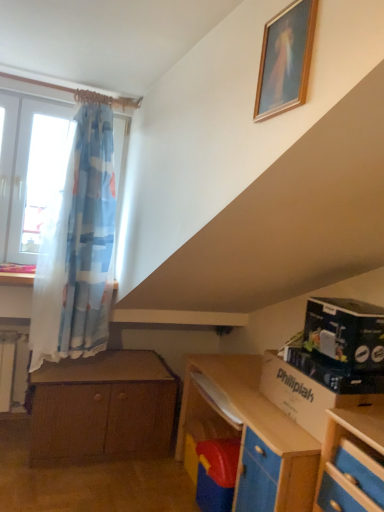
Question: Does brown wooden chest of drawers at lower left appear on the left side of black cardboard box at right?

Choices:
 (A) yes
 (B) no

Answer: (A)

Question: Is brown wooden chest of drawers at lower left positioned far away from black cardboard box at right?

Choices:
 (A) no
 (B) yes

Answer: (B)

Question: Is black cardboard box at right inside brown wooden chest of drawers at lower left?

Choices:
 (A) yes
 (B) no

Answer: (B)

Question: Is brown wooden chest of drawers at lower left facing away from black cardboard box at right?

Choices:
 (A) yes
 (B) no

Answer: (B)

Question: Is brown wooden chest of drawers at lower left in front of black cardboard box at right?

Choices:
 (A) no
 (B) yes

Answer: (A)

Question: Considering the relative positions of black cardboard box at right and brown wooden chest of drawers at lower left in the image provided, is black cardboard box at right to the left or to the right of brown wooden chest of drawers at lower left?

Choices:
 (A) left
 (B) right

Answer: (B)

Question: From the image's perspective, relative to brown wooden chest of drawers at lower left, is black cardboard box at right above or below?

Choices:
 (A) below
 (B) above

Answer: (B)

Question: In the image, is black cardboard box at right positioned in front of or behind brown wooden chest of drawers at lower left?

Choices:
 (A) front
 (B) behind

Answer: (A)

Question: From a real-world perspective, relative to brown wooden chest of drawers at lower left, is black cardboard box at right vertically above or below?

Choices:
 (A) below
 (B) above

Answer: (B)

Question: Considering the positions of brown wooden chest of drawers at lower left and wooden picture frame at upper center in the image, is brown wooden chest of drawers at lower left bigger or smaller than wooden picture frame at upper center?

Choices:
 (A) small
 (B) big

Answer: (B)

Question: Considering the positions of brown wooden chest of drawers at lower left and wooden picture frame at upper center in the image, is brown wooden chest of drawers at lower left taller or shorter than wooden picture frame at upper center?

Choices:
 (A) short
 (B) tall

Answer: (B)

Question: Considering the positions of brown wooden chest of drawers at lower left and wooden picture frame at upper center in the image, is brown wooden chest of drawers at lower left wider or thinner than wooden picture frame at upper center?

Choices:
 (A) thin
 (B) wide

Answer: (B)

Question: Which is correct: brown wooden chest of drawers at lower left is inside wooden picture frame at upper center, or outside of it?

Choices:
 (A) inside
 (B) outside

Answer: (B)

Question: Is black cardboard box at right in front of or behind cardboard box at lower right in the image?

Choices:
 (A) behind
 (B) front

Answer: (A)

Question: From a real-world perspective, is black cardboard box at right positioned above or below cardboard box at lower right?

Choices:
 (A) below
 (B) above

Answer: (B)